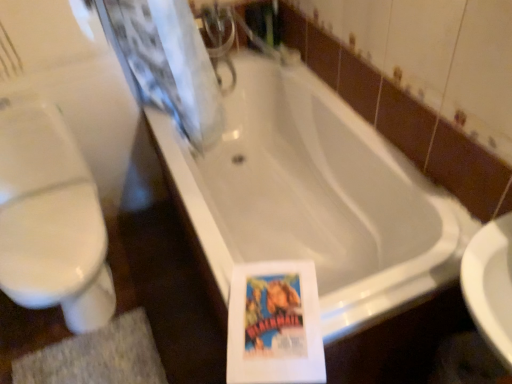
I want to click on free space above gray textured bath mat at lower left (from a real-world perspective), so click(x=95, y=358).